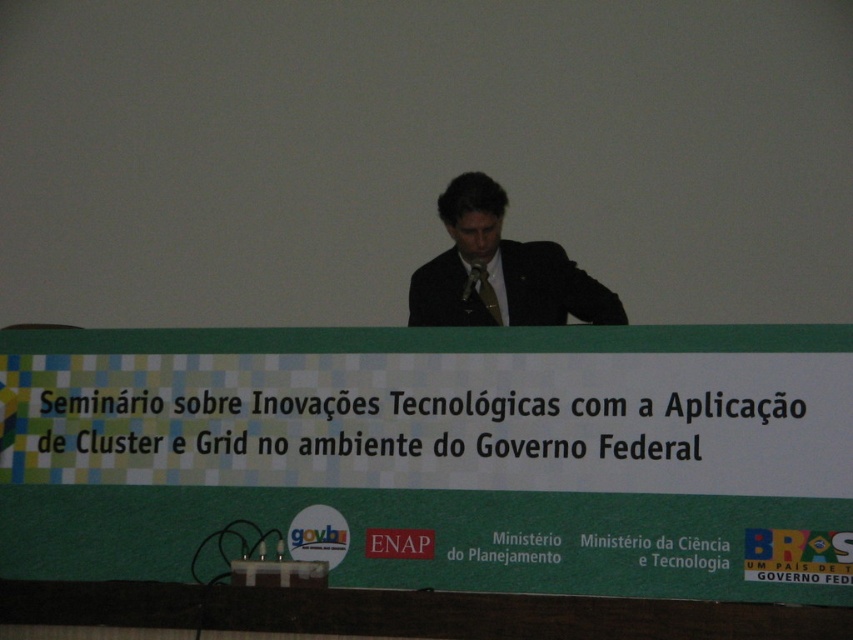
Does matte black suit at center have a lesser width compared to matte brown tie at center?

Incorrect, matte black suit at center's width is not less than matte brown tie at center's.

You are a GUI agent. You are given a task and a screenshot of the screen. Output one action in this format:
    pyautogui.click(x=<x>, y=<y>)
    Task: Click on the matte black suit at center
    This screenshot has width=853, height=640.
    Given the screenshot: What is the action you would take?
    pyautogui.click(x=500, y=269)

At what (x,y) coordinates should I click in order to perform the action: click on matte black suit at center. Please return your answer as a coordinate pair (x, y). This screenshot has width=853, height=640. Looking at the image, I should click on (500, 269).

Which of these two, green fabric banner at center or matte brown tie at center, stands shorter?

matte brown tie at center is shorter.

Is green fabric banner at center shorter than matte brown tie at center?

In fact, green fabric banner at center may be taller than matte brown tie at center.

Does point (598, 364) come farther from viewer compared to point (491, 292)?

No, (598, 364) is closer to viewer.

The height and width of the screenshot is (640, 853). I want to click on green fabric banner at center, so click(440, 456).

Which of these two, green fabric banner at center or matte black suit at center, stands shorter?

With less height is matte black suit at center.

Does green fabric banner at center have a greater height compared to matte black suit at center?

Correct, green fabric banner at center is much taller as matte black suit at center.

The width and height of the screenshot is (853, 640). What are the coordinates of `green fabric banner at center` in the screenshot? It's located at (440, 456).